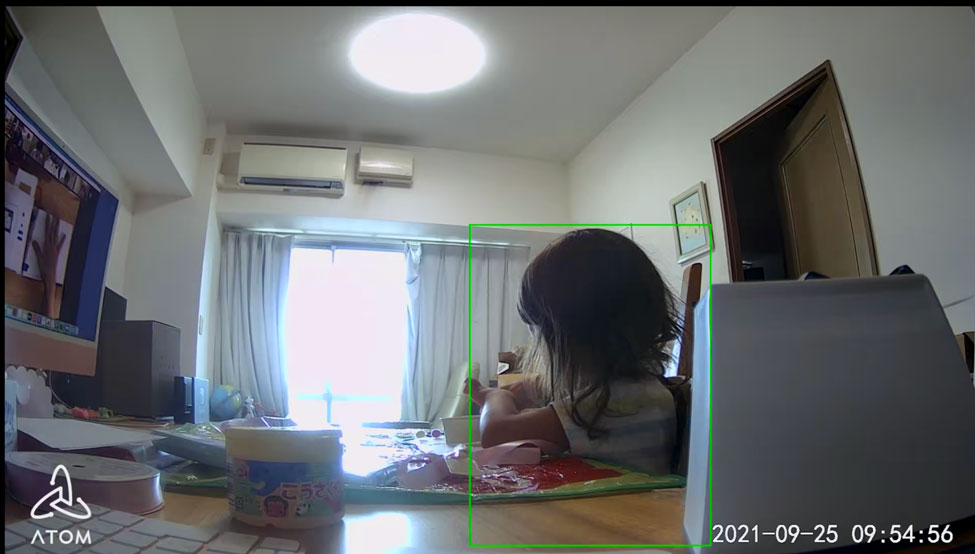
Where is `glass door`? glass door is located at coordinates (355, 316).